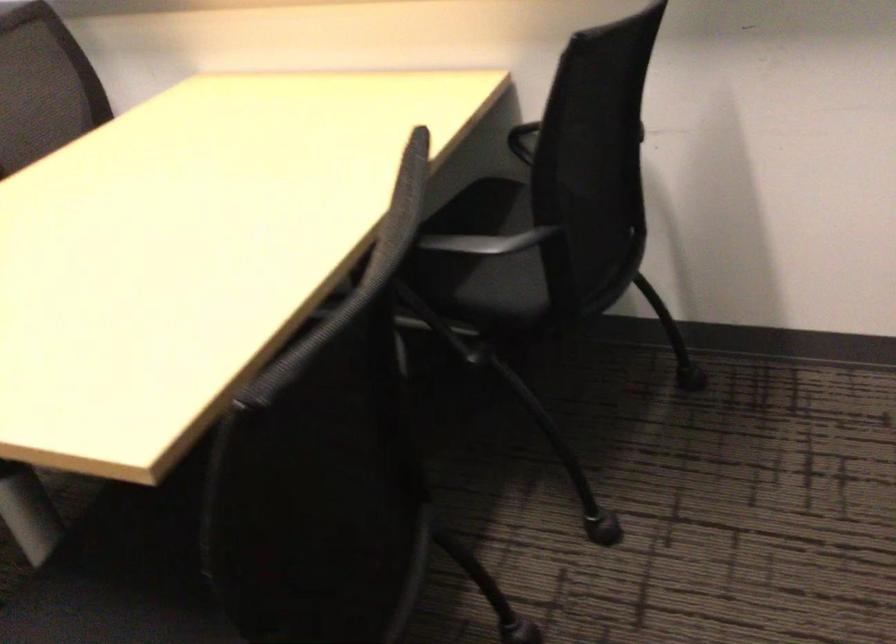
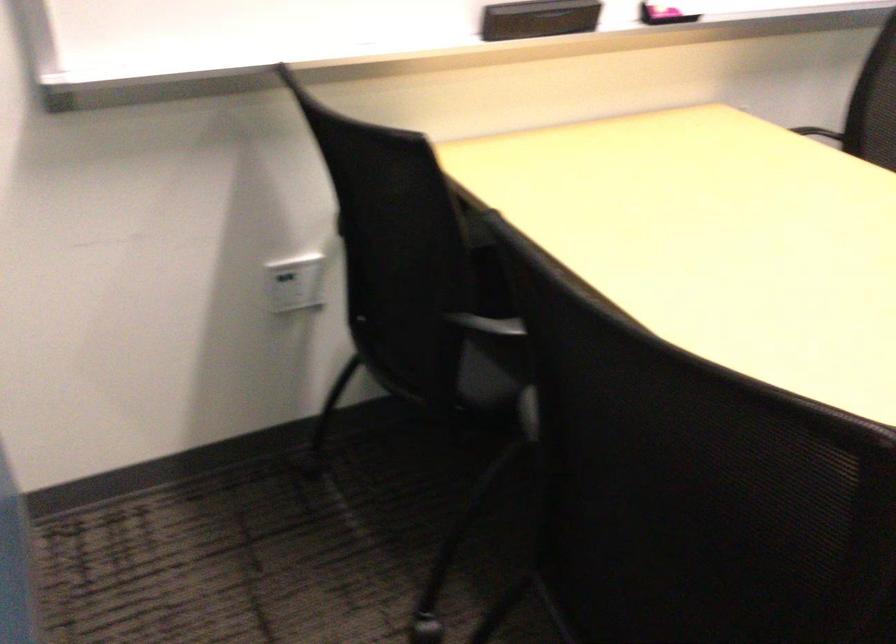
Find the pixel in the second image that matches [618,122] in the first image.

(817, 131)